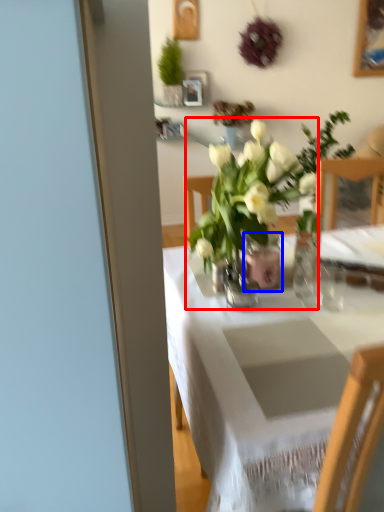
Question: Which object appears closest to the camera in this image, houseplant (highlighted by a red box) or vase (highlighted by a blue box)?

Choices:
 (A) houseplant
 (B) vase

Answer: (A)